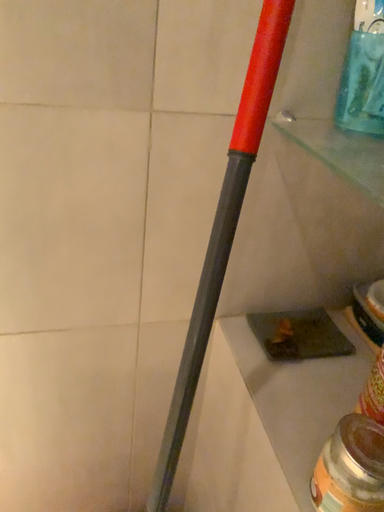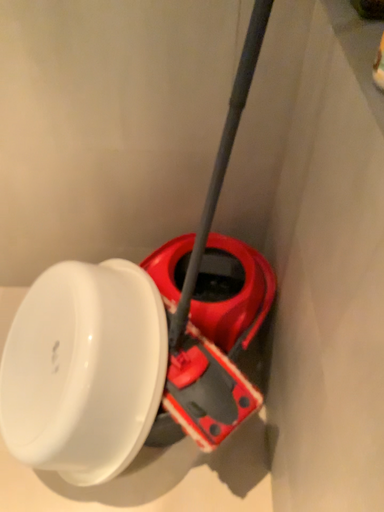
Question: How did the camera likely rotate when shooting the video?

Choices:
 (A) rotated upward
 (B) rotated downward

Answer: (B)